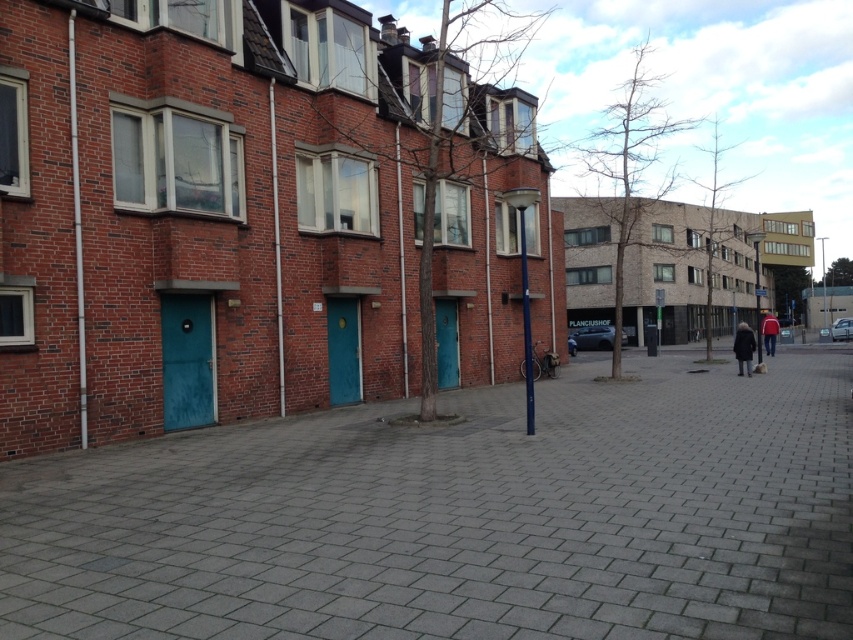
Question: Among these points, which one is farthest from the camera?

Choices:
 (A) (773, 328)
 (B) (750, 358)

Answer: (A)

Question: In this image, where is gray concrete pavement at center located relative to dark gray coat at lower right?

Choices:
 (A) above
 (B) below

Answer: (B)

Question: Among these objects, which one is nearest to the camera?

Choices:
 (A) red fabric jacket at right
 (B) dark gray coat at lower right

Answer: (B)

Question: Can you confirm if dark gray coat at lower right is bigger than red fabric jacket at right?

Choices:
 (A) yes
 (B) no

Answer: (B)

Question: Which object is closer to the camera taking this photo?

Choices:
 (A) dark gray coat at lower right
 (B) red fabric jacket at right
 (C) gray concrete pavement at center

Answer: (C)

Question: Is the position of gray concrete pavement at center more distant than that of red fabric jacket at right?

Choices:
 (A) no
 (B) yes

Answer: (A)